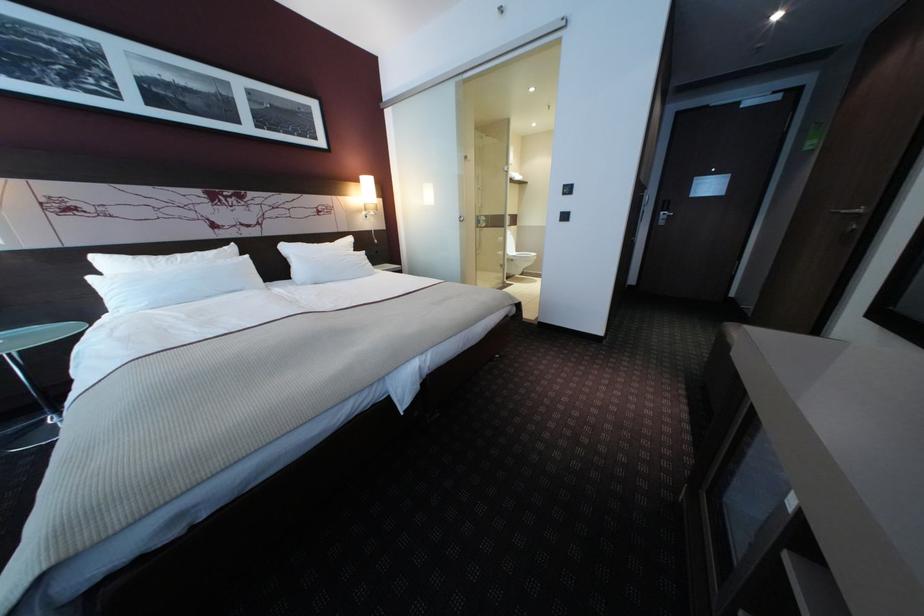
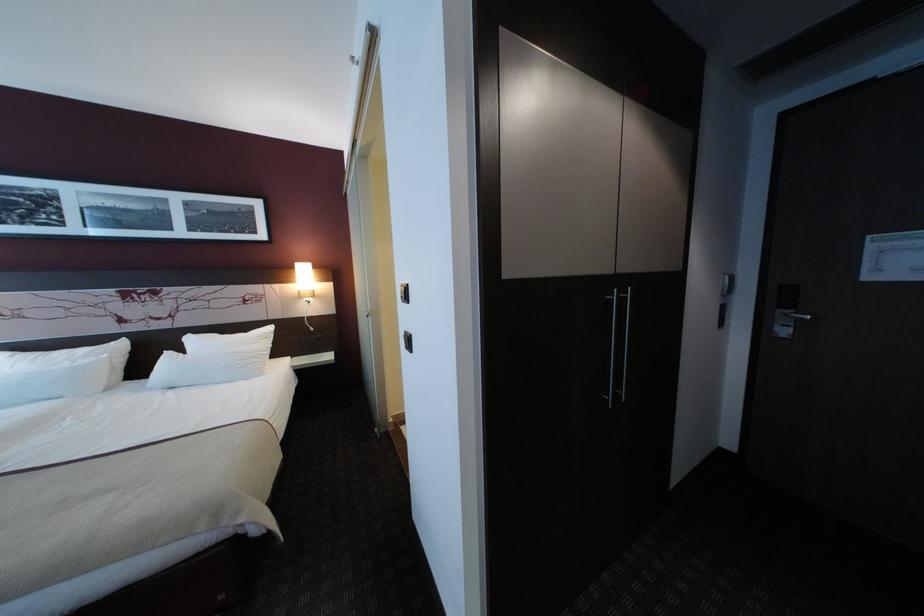
Which direction would the cameraman need to move to produce the second image?

The cameraman moved toward right, forward.